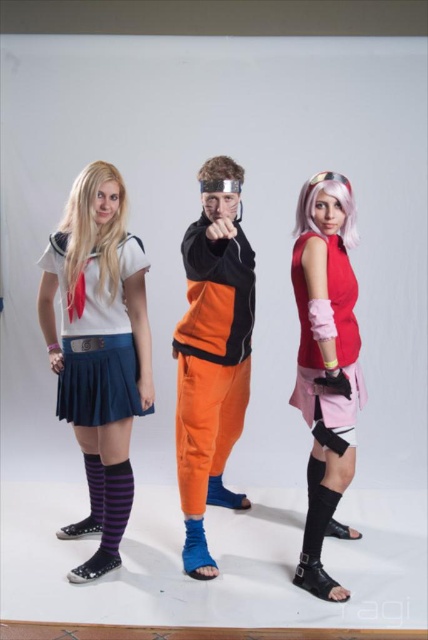
You are a costume designer examining the cosplay scene. You notice two socks in the image. Which sock is taller between the purple striped sock at lower left and the blue fabric sock at center?

The purple striped sock at lower left is taller than the blue fabric sock at center.

You are a photographer setting up for a photoshoot. You notice two socks in the scene, the purple striped sock at lower left and the blue fabric sock at center. Which sock is located to the left of the other?

The purple striped sock at lower left is positioned on the left side of blue fabric sock at center.

You are a costume designer preparing to adjust the outfits of the cosplayers in the image. You notice the satin white blouse at center and the orange fabric pants at center. Which of these two items is more likely to require additional fabric to match the other in size?

The satin white blouse at center has a smaller size compared to orange fabric pants at center, so the blouse would need more fabric to match the pants in size.